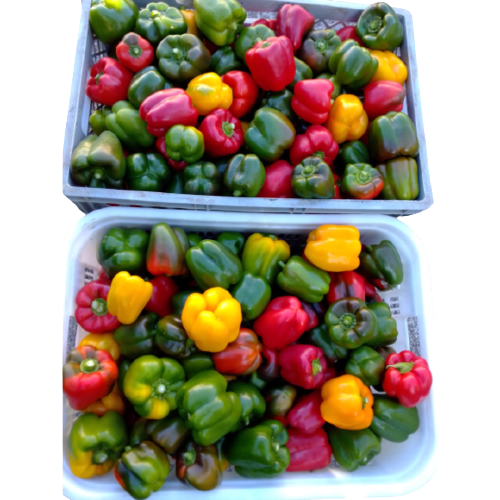
Locate an element on the screen. Image resolution: width=500 pixels, height=500 pixels. vents is located at coordinates (89, 275), (397, 305), (98, 53), (268, 15), (325, 25), (95, 107), (89, 206).